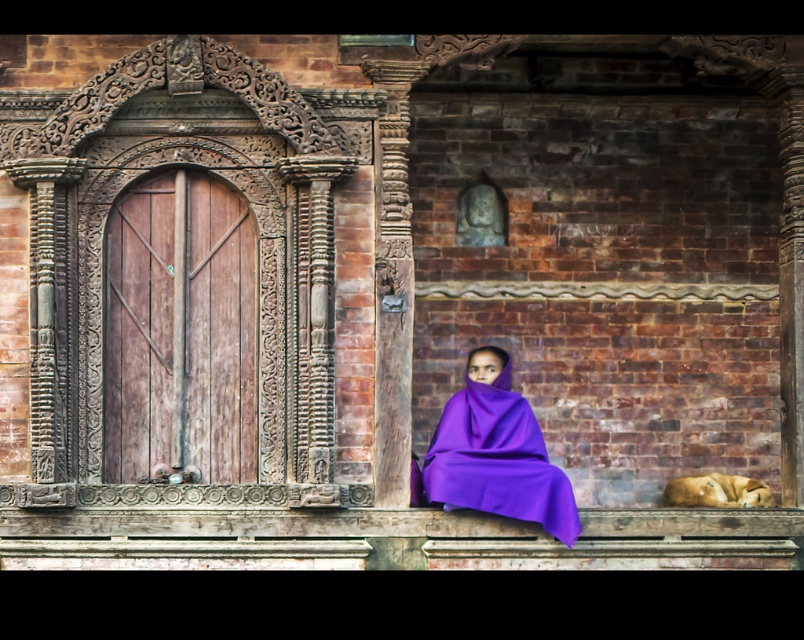
Question: Is purple fabric at center in front of golden fur dog at lower right?

Choices:
 (A) yes
 (B) no

Answer: (A)

Question: Which point is closer to the camera?

Choices:
 (A) (718, 474)
 (B) (493, 392)

Answer: (B)

Question: Can you confirm if purple fabric at center is smaller than golden fur dog at lower right?

Choices:
 (A) no
 (B) yes

Answer: (A)

Question: Is purple fabric at center smaller than golden fur dog at lower right?

Choices:
 (A) no
 (B) yes

Answer: (A)

Question: Which object is farther from the camera taking this photo?

Choices:
 (A) golden fur dog at lower right
 (B) purple fabric at center

Answer: (A)